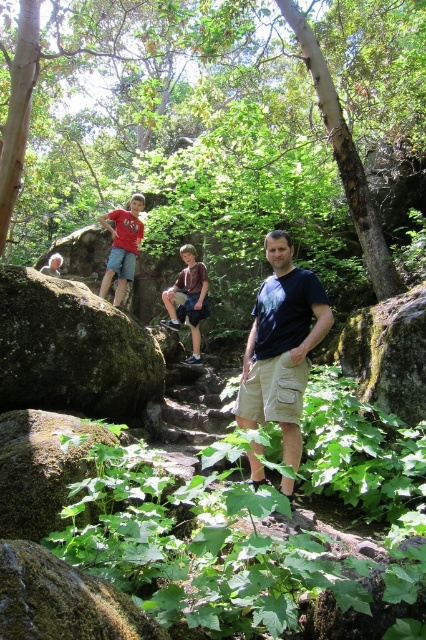
Question: Is green leafy forest at center further to the viewer compared to black cotton t-shirt at center?

Choices:
 (A) no
 (B) yes

Answer: (B)

Question: Considering the real-world distances, which object is closest to the matte red t-shirt at left?

Choices:
 (A) black cotton t-shirt at center
 (B) green mossy rock at left
 (C) brown cotton shirt at center
 (D) green leafy forest at center

Answer: (C)

Question: Is green mossy rock at left thinner than matte red t-shirt at left?

Choices:
 (A) no
 (B) yes

Answer: (A)

Question: Which object is the closest to the green mossy rock at left?

Choices:
 (A) green leafy forest at center
 (B) brown cotton shirt at center
 (C) matte red t-shirt at left

Answer: (C)

Question: Which of these objects is positioned farthest from the matte red t-shirt at left?

Choices:
 (A) brown cotton shirt at center
 (B) black cotton t-shirt at center
 (C) green leafy forest at center

Answer: (C)

Question: Is green mossy rock at left thinner than matte red t-shirt at left?

Choices:
 (A) no
 (B) yes

Answer: (A)